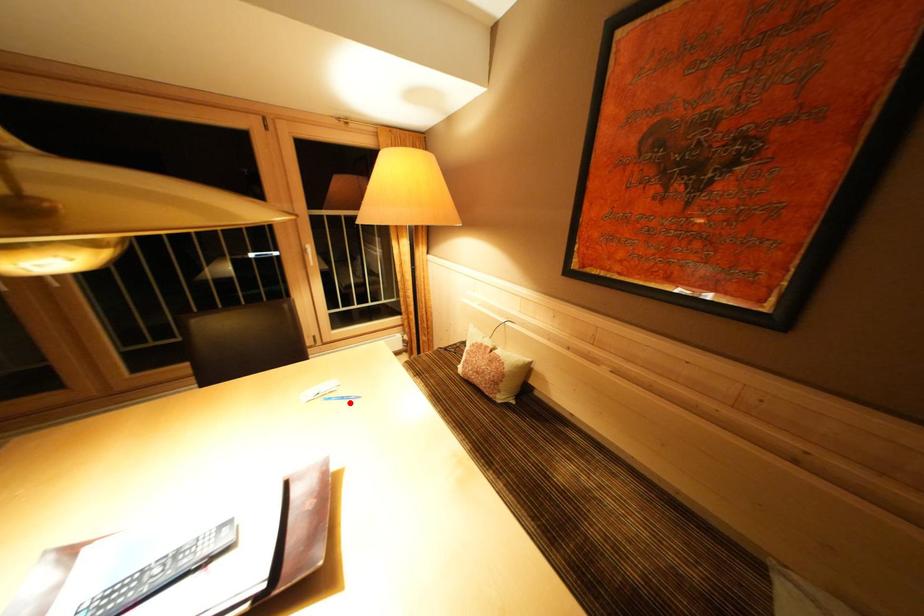
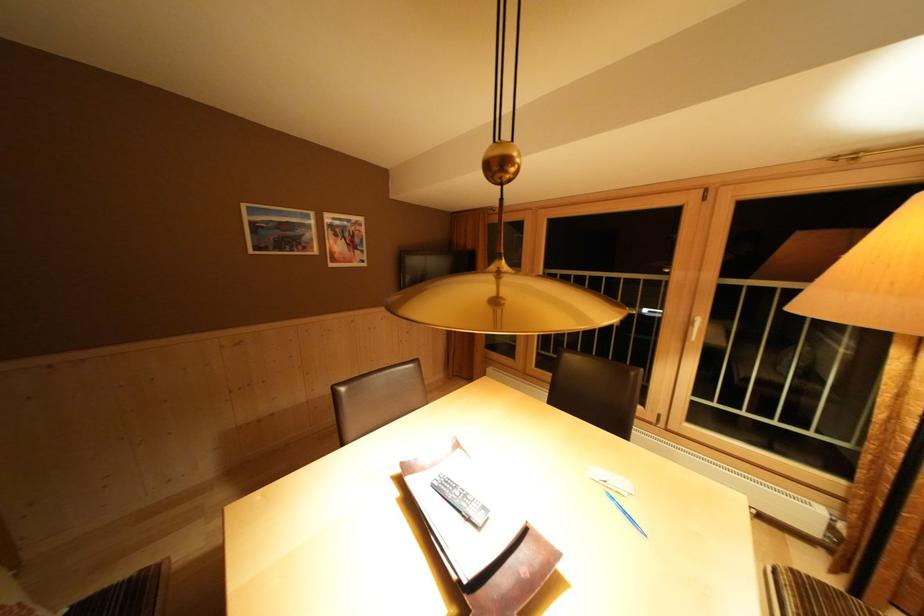
In the second image, find the point that corresponds to the highlighted location in the first image.

(633, 517)